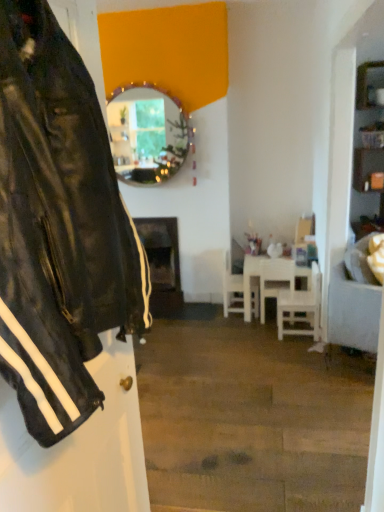
Question: Can you confirm if white glossy chair at center, which is the 2th chair from left to right, is wider than wooden-framed mirror at upper center?

Choices:
 (A) yes
 (B) no

Answer: (A)

Question: Is white glossy chair at center, the second chair when ordered from right to left, shorter than wooden-framed mirror at upper center?

Choices:
 (A) no
 (B) yes

Answer: (B)

Question: Does white glossy chair at center, which is the 2th chair from left to right, come in front of wooden-framed mirror at upper center?

Choices:
 (A) yes
 (B) no

Answer: (A)

Question: Is white glossy chair at center, the second chair when ordered from right to left, smaller than wooden-framed mirror at upper center?

Choices:
 (A) yes
 (B) no

Answer: (A)

Question: Is white glossy chair at center, which is the 2th chair from left to right, positioned beyond the bounds of wooden-framed mirror at upper center?

Choices:
 (A) no
 (B) yes

Answer: (B)

Question: Are white glossy chair at center, which is the 2th chair from left to right, and wooden-framed mirror at upper center located far from each other?

Choices:
 (A) yes
 (B) no

Answer: (A)

Question: Is white matte chair at center, the first chair when ordered from left to right, further to camera compared to wooden shelves at right?

Choices:
 (A) yes
 (B) no

Answer: (A)

Question: Is white matte chair at center, the first chair when ordered from left to right, thinner than wooden shelves at right?

Choices:
 (A) yes
 (B) no

Answer: (A)

Question: Does white matte chair at center, the third chair viewed from the right, have a greater height compared to wooden shelves at right?

Choices:
 (A) yes
 (B) no

Answer: (B)

Question: Is white matte chair at center, the third chair viewed from the right, wider than wooden shelves at right?

Choices:
 (A) yes
 (B) no

Answer: (B)

Question: Can wooden shelves at right be found inside white matte chair at center, the third chair viewed from the right?

Choices:
 (A) yes
 (B) no

Answer: (B)

Question: From a real-world perspective, is white matte chair at center, the third chair viewed from the right, located beneath wooden shelves at right?

Choices:
 (A) yes
 (B) no

Answer: (A)

Question: Is wooden-framed mirror at upper center far away from white fabric couch at right?

Choices:
 (A) yes
 (B) no

Answer: (A)